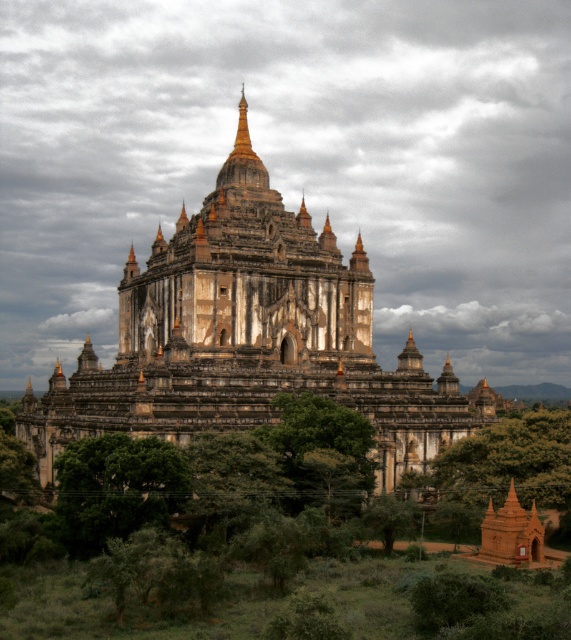
Which is more to the right, green leafy tree at lower left or green leafy tree at lower center?

From the viewer's perspective, green leafy tree at lower center appears more on the right side.

Which of these two, green leafy tree at lower left or green leafy tree at lower center, stands taller?

green leafy tree at lower left is taller.

The image size is (571, 640). I want to click on green leafy tree at lower left, so click(x=115, y=488).

Find the location of a particular element. green leafy tree at lower left is located at coordinates (115, 488).

Which is more to the right, golden stone temple at center or green leafy tree at lower center?

green leafy tree at lower center

Is point (464, 412) positioned before point (215, 438)?

No, it is not.

I want to click on golden stone temple at center, so click(x=247, y=337).

Is golden stone temple at center wider than green leafy tree at center?

Yes.

Locate an element on the screen. golden stone temple at center is located at coordinates (247, 337).

At what (x,y) coordinates should I click in order to perform the action: click on golden stone temple at center. Please return your answer as a coordinate pair (x, y). The image size is (571, 640). Looking at the image, I should click on (247, 337).